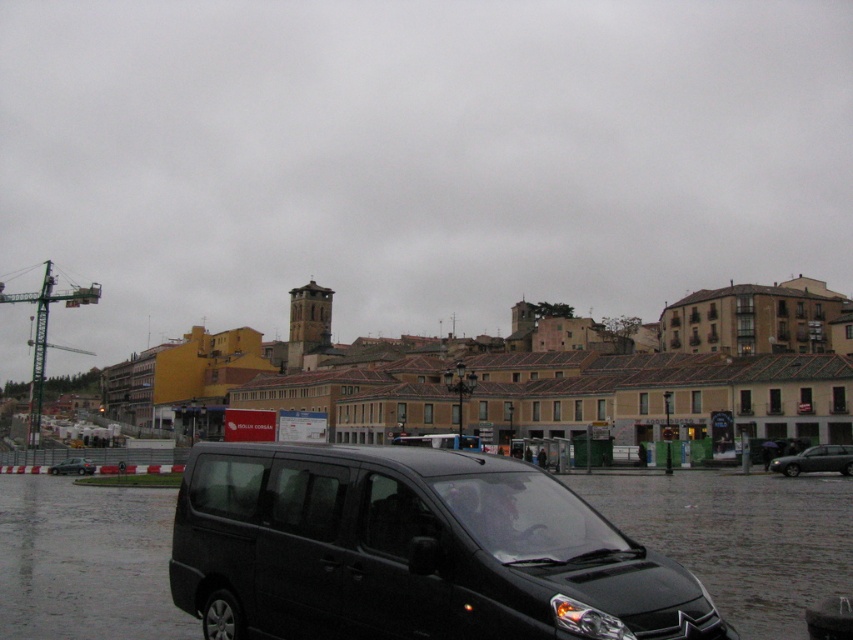
Consider the image. You are standing in the urban scene depicted. You want to place a 1.5 meter wide advertisement board at the point marked as point (462,512). Considering the distance from you to that point, will the advertisement board be visible in its entirety without being obscured by any nearby objects?

The point (462,512) is 10.10 meters away from the viewer. Since the advertisement board is only 1.5 meters wide and the distance is sufficient, the entire board will be visible without any obstruction from nearby objects.

You are a delivery driver who needs to park your vehicle between the dark gray metallic car at right and the black matte van at center. Given that your delivery truck is 2 meters tall, can you safely park there without hitting the overhead structures?

The dark gray metallic car at right is not as tall as black matte van at center. Since the black matte van at center is taller, but the description does not provide specific height measurements, it is uncertain if the delivery truck can safely park there without hitting overhead structures. More information about the exact heights or clearance is needed.

You are a delivery driver who needs to park your vehicle in a tight space between the black matte van at lower left and the metallic silver hatchback at lower left. Based on the scene description, which vehicle should you avoid parking next to to ensure enough space?

You should avoid parking next to the black matte van at lower left because it is bigger than the metallic silver hatchback at lower left, leaving less space between them.